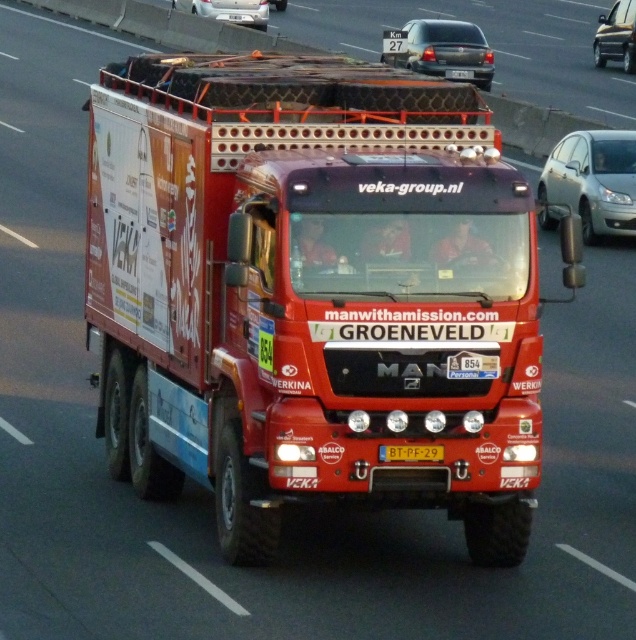
Question: Estimate the real-world distances between objects in this image. Which object is farther from the white glossy car at upper center?

Choices:
 (A) shiny red truck at center
 (B) satin silver sedan at right
 (C) matte black sedan at upper center
 (D) white plastic license plate at center

Answer: (D)

Question: Observing the image, what is the correct spatial positioning of shiny red truck at center in reference to satin silver sedan at right?

Choices:
 (A) left
 (B) right

Answer: (A)

Question: Where is shiny red truck at center located in relation to metallic silver car at upper right in the image?

Choices:
 (A) left
 (B) right

Answer: (A)

Question: Which point is farther from the camera taking this photo?

Choices:
 (A) (632, 58)
 (B) (556, 205)
 (C) (438, 461)

Answer: (A)

Question: Estimate the real-world distances between objects in this image. Which object is closer to the metallic silver car at upper right?

Choices:
 (A) white plastic license plate at center
 (B) matte black sedan at upper center

Answer: (B)

Question: Does white glossy car at upper center have a smaller size compared to yellow plastic license plate at center?

Choices:
 (A) yes
 (B) no

Answer: (B)